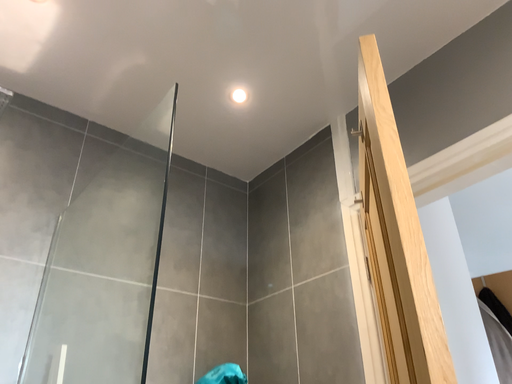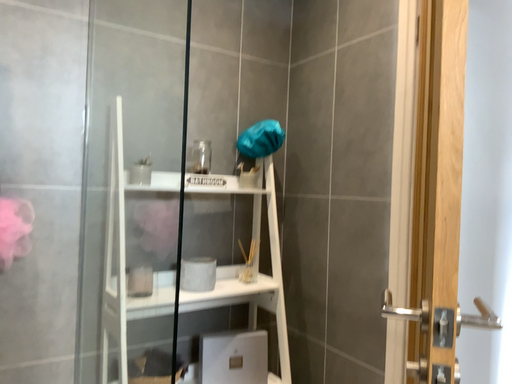
Question: Which way did the camera rotate in the video?

Choices:
 (A) rotated upward
 (B) rotated downward

Answer: (B)